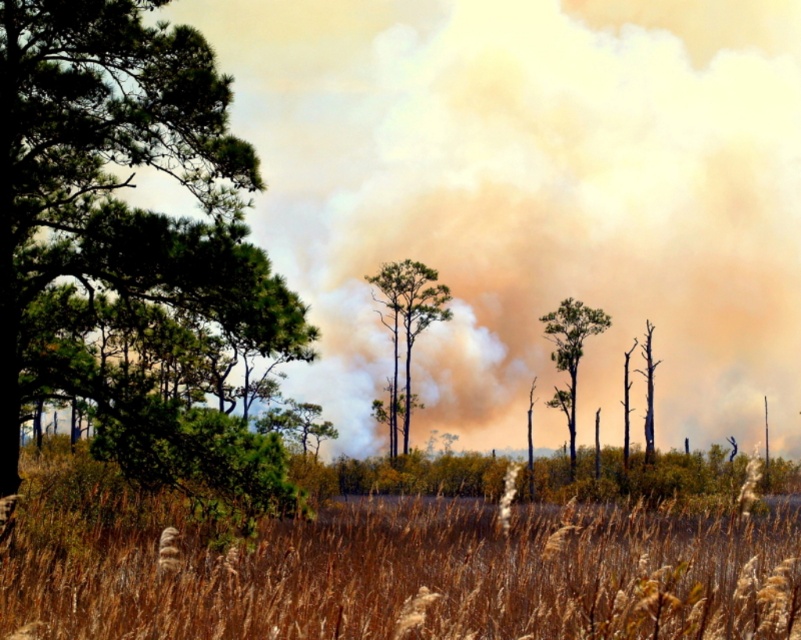
Between green matte tree at left and brown dry grass at center, which one has less height?

brown dry grass at center

Does green matte tree at left have a greater width compared to brown dry grass at center?

No, green matte tree at left is not wider than brown dry grass at center.

Between point (115, 148) and point (533, 580), which one is positioned behind?

The point (115, 148) is behind.

This screenshot has height=640, width=801. I want to click on green matte tree at left, so click(131, 250).

Which of these two, green leafy tree at center or charred wood tree at center, stands taller?

Standing taller between the two is green leafy tree at center.

Does green leafy tree at center have a greater width compared to charred wood tree at center?

Incorrect, green leafy tree at center's width does not surpass charred wood tree at center's.

Is point (566, 372) behind point (651, 406)?

That is True.

What are the coordinates of `green leafy tree at center` in the screenshot? It's located at (570, 355).

Looking at this image, can you confirm if green matte tree at left is wider than charred wood tree at center?

Correct, the width of green matte tree at left exceeds that of charred wood tree at center.

Between green matte tree at left and charred wood tree at center, which one appears on the right side from the viewer's perspective?

charred wood tree at center

Does point (15, 54) come closer to viewer compared to point (651, 364)?

Yes, it is in front of point (651, 364).

Locate an element on the screen. This screenshot has height=640, width=801. green matte tree at left is located at coordinates (131, 250).